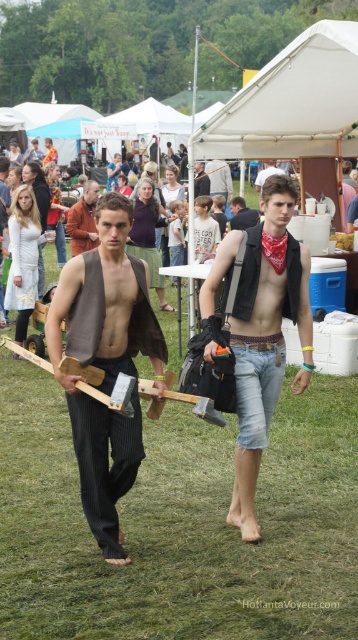
You are a photographer at the event and want to capture a photo that includes both the green grass at center and the dark brown leather jacket at center. Based on their positions, which object should you focus on first to ensure both are in the frame?

The green grass at center is below the dark brown leather jacket at center, so you should focus on the dark brown leather jacket at center first to ensure both are in the frame.

You are organizing a small picnic and need to place a picnic blanket on the green grass at center. However, there is a dark brown leather jacket at center nearby. Given the distance between them, will the jacket be within a 30 feet safety zone to avoid placing the blanket too close?

The distance between the green grass at center and the dark brown leather jacket at center is 32.82 feet, which is just beyond the 30 feet safety zone. Therefore, placing the picnic blanket on the green grass at center would keep it safely outside the jacket area.